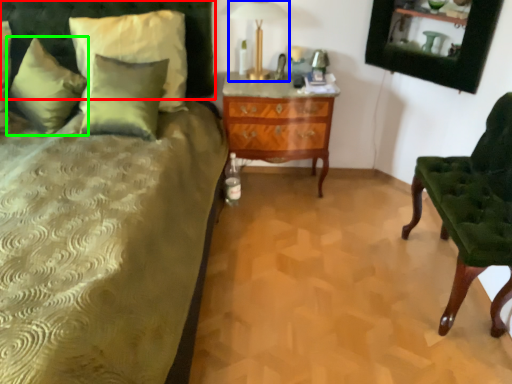
Question: Considering the real-world distances, which object is farthest from headboard (highlighted by a red box)? table lamp (highlighted by a blue box) or pillow (highlighted by a green box)?

Choices:
 (A) table lamp
 (B) pillow

Answer: (A)